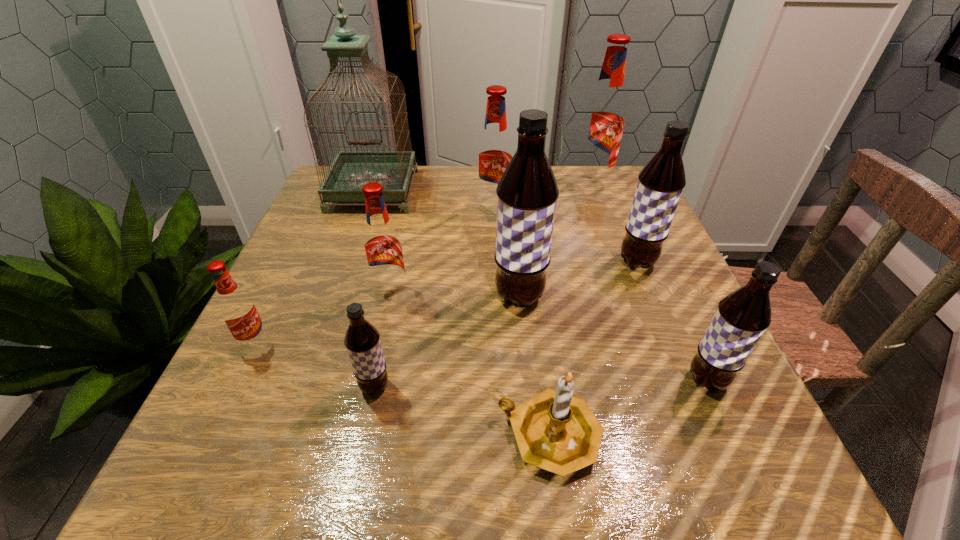
You are a GUI agent. You are given a task and a screenshot of the screen. Output one action in this format:
    pyautogui.click(x=<x>, y=<y>)
    Task: Click on the blank space located on the left of the rightmost red root beer
    This screenshot has height=540, width=960.
    Given the screenshot: What is the action you would take?
    pyautogui.click(x=456, y=185)

Find the location of a particular element. The image size is (960, 540). vacant space located on the left of the second farthest root beer is located at coordinates (315, 214).

Locate an element on the screen. This screenshot has height=540, width=960. free region located 0.200m on the back of the third smallest brown root beer is located at coordinates tap(612, 200).

You are a GUI agent. You are given a task and a screenshot of the screen. Output one action in this format:
    pyautogui.click(x=<x>, y=<y>)
    Task: Click on the free space located 0.280m on the back of the second nearest red root beer
    The width and height of the screenshot is (960, 540).
    Given the screenshot: What is the action you would take?
    pyautogui.click(x=410, y=206)

Image resolution: width=960 pixels, height=540 pixels. Find the location of `free space located 0.070m on the left of the second smallest brown root beer`. free space located 0.070m on the left of the second smallest brown root beer is located at coordinates (642, 380).

The height and width of the screenshot is (540, 960). Identify the location of free space located on the right of the sixth farthest root beer. (384, 343).

The width and height of the screenshot is (960, 540). What are the coordinates of `vacant space located on the back of the smallest brown root beer` in the screenshot? It's located at (382, 349).

Where is `vacant space located 0.330m on the back of the gold candle holder`? This screenshot has height=540, width=960. vacant space located 0.330m on the back of the gold candle holder is located at coordinates (528, 260).

Image resolution: width=960 pixels, height=540 pixels. I want to click on birdcage that is at the far edge, so click(x=350, y=170).

You are a GUI agent. You are given a task and a screenshot of the screen. Output one action in this format:
    pyautogui.click(x=<x>, y=<y>)
    Task: Click on the object that is at the near edge
    
    Given the screenshot: What is the action you would take?
    pyautogui.click(x=555, y=431)